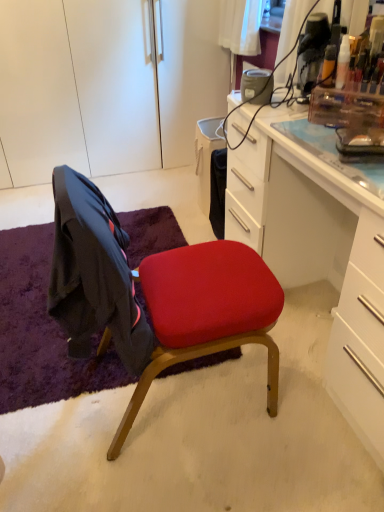
Question: Does matte red cushioned chair at center have a greater height compared to white matte cabinet at upper left?

Choices:
 (A) yes
 (B) no

Answer: (B)

Question: Is matte red cushioned chair at center wider than white matte cabinet at upper left?

Choices:
 (A) no
 (B) yes

Answer: (A)

Question: Is matte red cushioned chair at center positioned far away from white matte cabinet at upper left?

Choices:
 (A) no
 (B) yes

Answer: (B)

Question: Is matte red cushioned chair at center to the left of white matte cabinet at upper left from the viewer's perspective?

Choices:
 (A) yes
 (B) no

Answer: (B)

Question: Is matte red cushioned chair at center shorter than white matte cabinet at upper left?

Choices:
 (A) no
 (B) yes

Answer: (B)

Question: Does matte red cushioned chair at center have a lesser width compared to white matte cabinet at upper left?

Choices:
 (A) no
 (B) yes

Answer: (B)

Question: Is the depth of purple shaggy rug at lower left less than that of white glossy desk at center?

Choices:
 (A) yes
 (B) no

Answer: (B)

Question: Are purple shaggy rug at lower left and white glossy desk at center located far from each other?

Choices:
 (A) yes
 (B) no

Answer: (B)

Question: From a real-world perspective, is purple shaggy rug at lower left located higher than white glossy desk at center?

Choices:
 (A) no
 (B) yes

Answer: (A)

Question: Does purple shaggy rug at lower left have a greater width compared to white glossy desk at center?

Choices:
 (A) yes
 (B) no

Answer: (A)

Question: Does purple shaggy rug at lower left come behind white glossy desk at center?

Choices:
 (A) yes
 (B) no

Answer: (A)

Question: Is white glossy desk at center surrounded by purple shaggy rug at lower left?

Choices:
 (A) no
 (B) yes

Answer: (A)

Question: From the image's perspective, is purple shaggy rug at lower left under matte red cushioned chair at center?

Choices:
 (A) no
 (B) yes

Answer: (B)